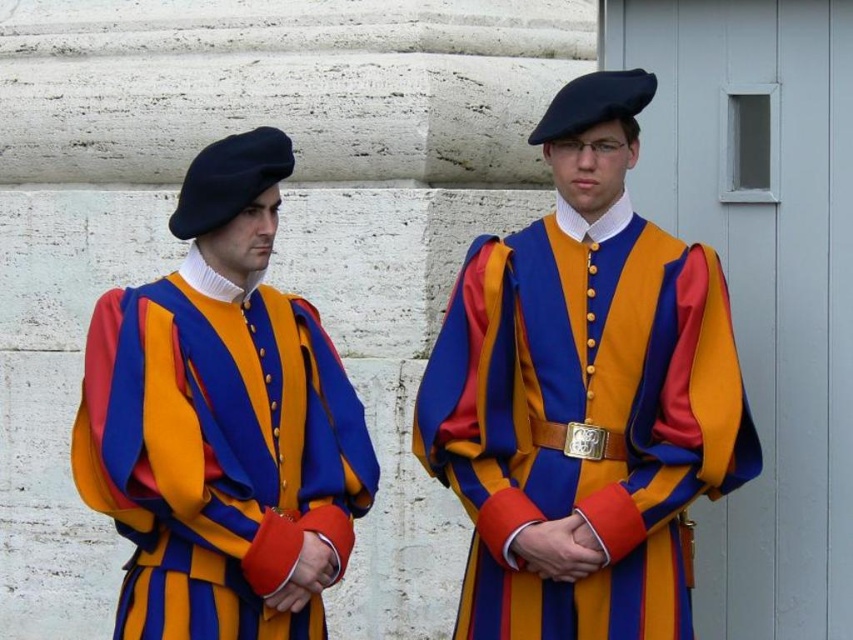
Who is lower down, matte woolen uniform at center or matte wool beret at left?

Positioned lower is matte wool beret at left.

In the scene shown: Can you confirm if matte woolen uniform at center is positioned below matte wool beret at left?

No, matte woolen uniform at center is not below matte wool beret at left.

Is point (618, 196) closer to camera compared to point (293, 404)?

No, (618, 196) is further to viewer.

The height and width of the screenshot is (640, 853). I want to click on matte woolen uniform at center, so click(584, 396).